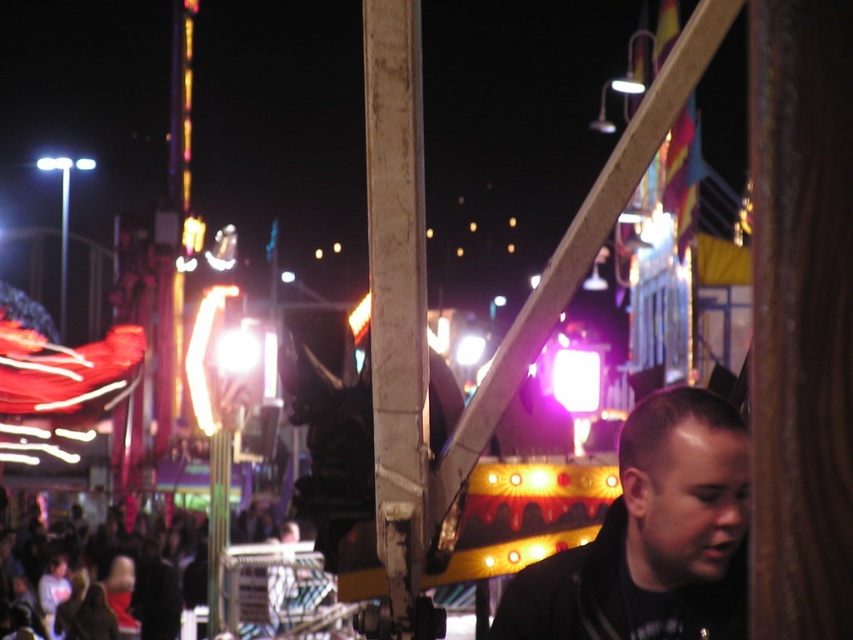
Question: Which object is farther from the camera taking this photo?

Choices:
 (A) black matte jacket at lower right
 (B) white painted wood pole at center
 (C) dark clothing crowd at lower left

Answer: (C)

Question: Can you confirm if black matte jacket at lower right is bigger than white painted wood pole at center?

Choices:
 (A) no
 (B) yes

Answer: (A)

Question: Which object is positioned farthest from the dark clothing crowd at lower left?

Choices:
 (A) black matte jacket at lower right
 (B) white painted wood pole at center

Answer: (A)

Question: Which object is farther from the camera taking this photo?

Choices:
 (A) white painted wood pole at center
 (B) dark clothing crowd at lower left
 (C) black matte jacket at lower right

Answer: (B)

Question: Can you confirm if black matte jacket at lower right is positioned below dark clothing crowd at lower left?

Choices:
 (A) yes
 (B) no

Answer: (B)

Question: Does white painted wood pole at center have a lesser width compared to dark clothing crowd at lower left?

Choices:
 (A) yes
 (B) no

Answer: (A)